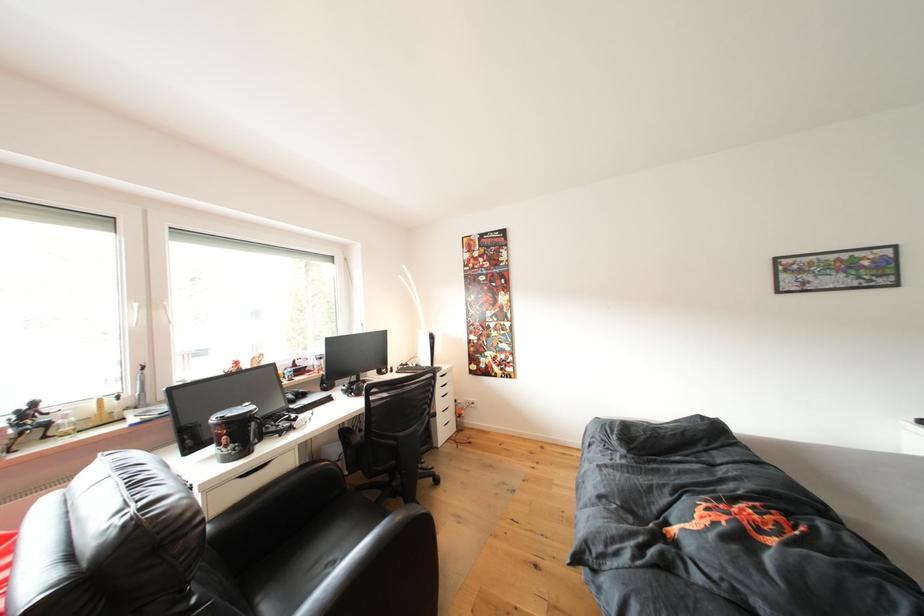
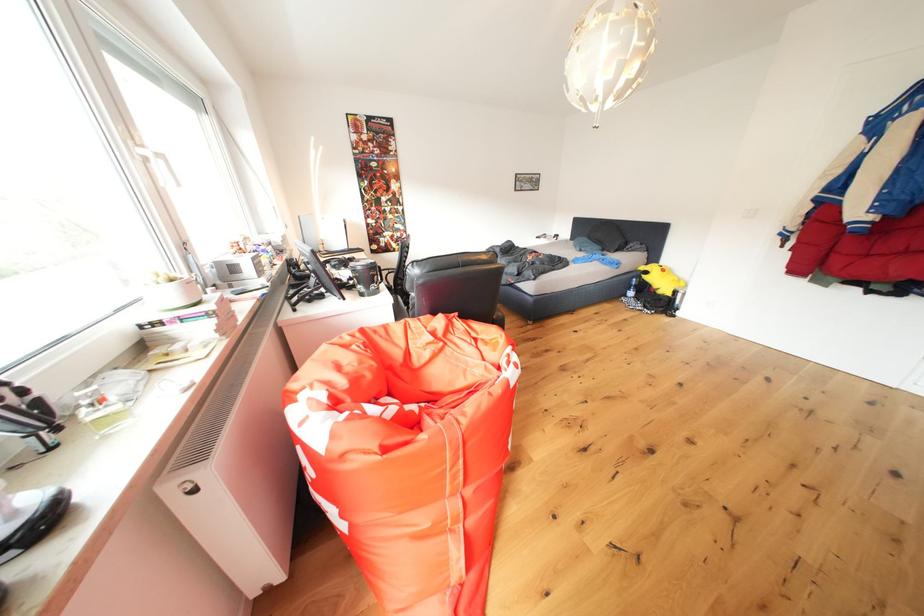
Question: I am providing you with two images of the same scene from different viewpoints. After the viewpoint changes to image2, which objects are now occluded?

Choices:
 (A) white window handle
 (B) white drawer handle
 (C) alarm clock buttons
 (D) plastic water bottle

Answer: (B)